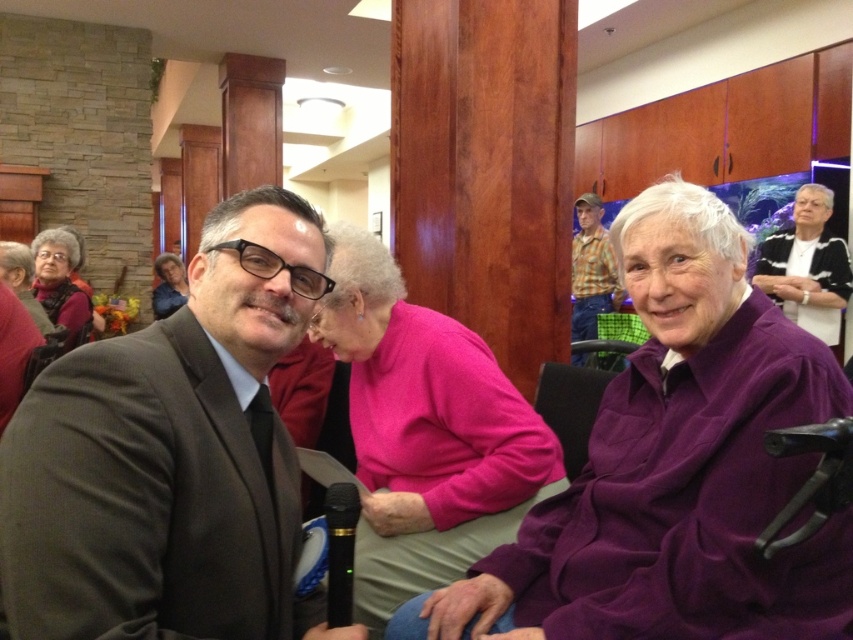
Looking at the scene, which object is smaller in size between the pink fleece sweater at center and the matte black sweater at upper left?

The pink fleece sweater at center is smaller in size compared to the matte black sweater at upper left.

You are attending a community event and want to take a photo of the pink fleece sweater at center and the matte black sweater at upper left. Can you see both of them clearly in the same photo without any obstruction?

The pink fleece sweater at center is in front of the matte black sweater at upper left, so the pink fleece sweater at center may block part of the matte black sweater at upper left in the photo.

You are a photographer setting up for a group photo. You notice the white textured sweater at upper right and the matte black sweater at upper left in the scene. Which of these two sweaters should you adjust to ensure they are at the same height in the photo?

The white textured sweater at upper right is much taller than the matte black sweater at upper left. To make them the same height in the photo, you should lower the white textured sweater at upper right or raise the matte black sweater at upper left.